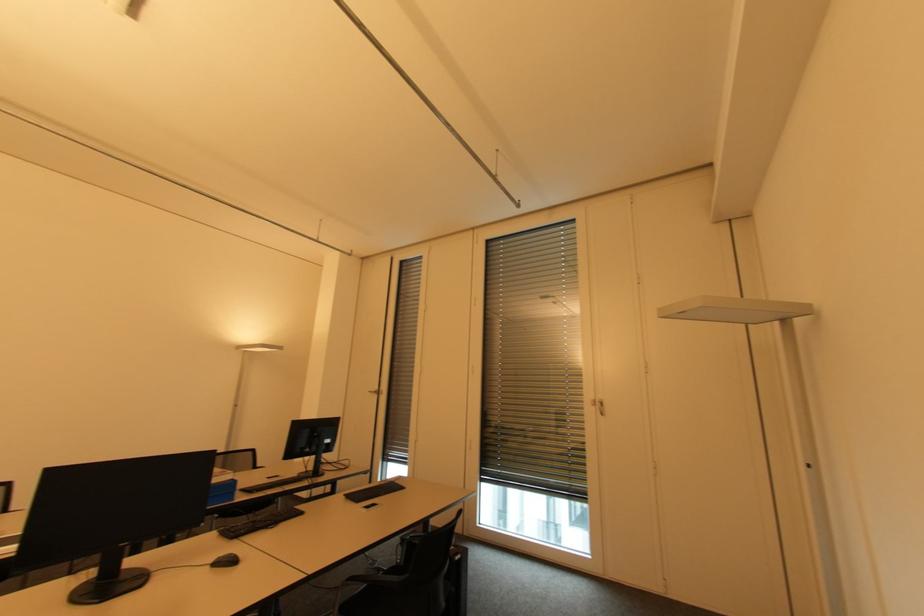
Describe the element at coordinates (222, 492) in the screenshot. I see `the blue file holder` at that location.